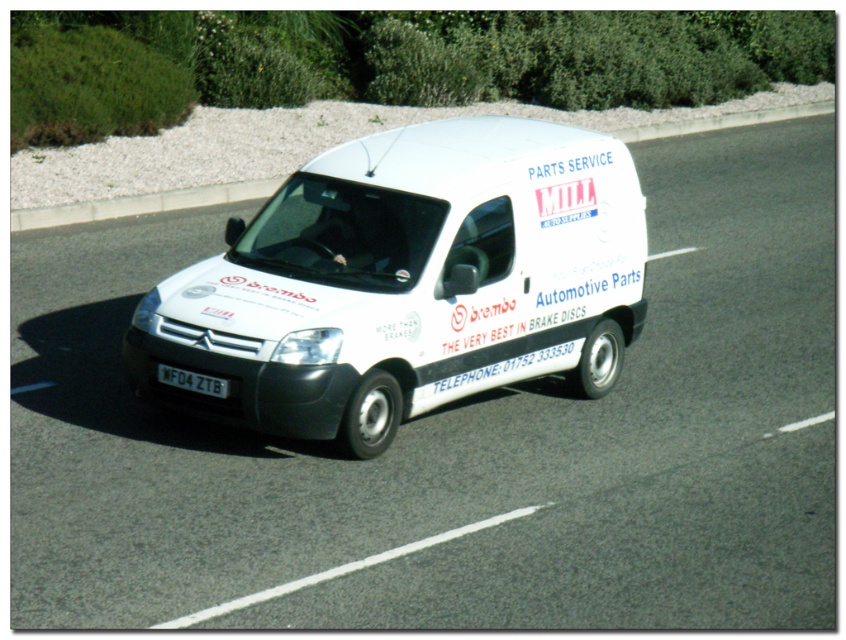
You are standing in front of the white Citroen van with the Brembo logos. There are two points marked on the van. One is at coordinate point (327, 262) and the other is at point (28, 218). Which point is closer to you?

Point (327, 262) is closer to the viewer than point 0.342, .034.

You are a delivery driver who needs to deliver a package to the van at the center of the image. The van has a specific point marked at coordinates (408, 282). Can you tell me where exactly this point is located on the van?

The point at coordinates (408, 282) is located on the white matte van at center.

Consider the image. You are a photographer trying to capture the license plate of the white Citroen van. You notice two points on the van, point 1 at coordinates (26, 228) and point 2 at coordinates (195, 387). Which point is closer to the camera?

Point 2 at coordinates (195, 387) is closer to the camera because point 1 is further away according to the description.